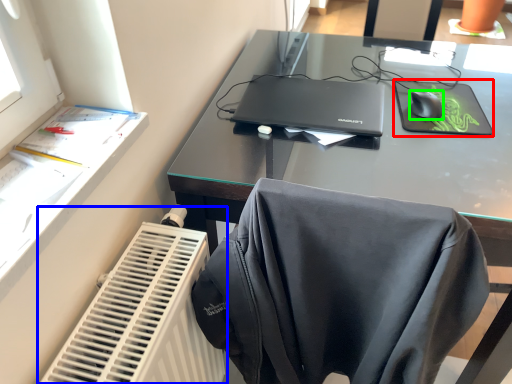
Question: Considering the real-world distances, which object is farthest from mousepad (highlighted by a red box)? radiator (highlighted by a blue box) or mouse (highlighted by a green box)?

Choices:
 (A) radiator
 (B) mouse

Answer: (A)